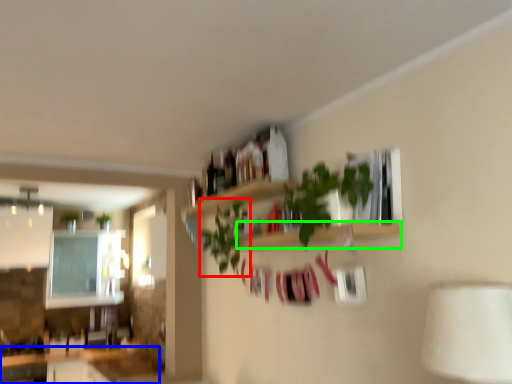
Question: Estimate the real-world distances between objects in this image. Which object is closer to plant (highlighted by a red box), counter top (highlighted by a blue box) or shelf (highlighted by a green box)?

Choices:
 (A) counter top
 (B) shelf

Answer: (B)